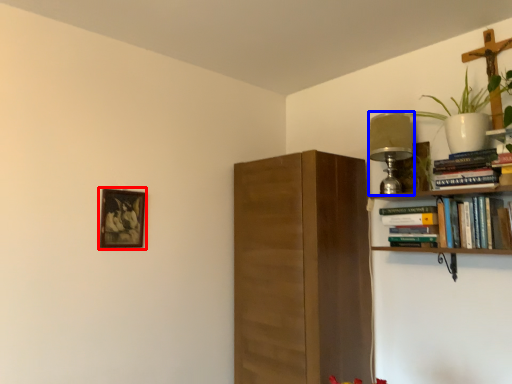
Question: Which point is closer to the camera, picture frame (highlighted by a red box) or lamp (highlighted by a blue box)?

Choices:
 (A) picture frame
 (B) lamp

Answer: (A)